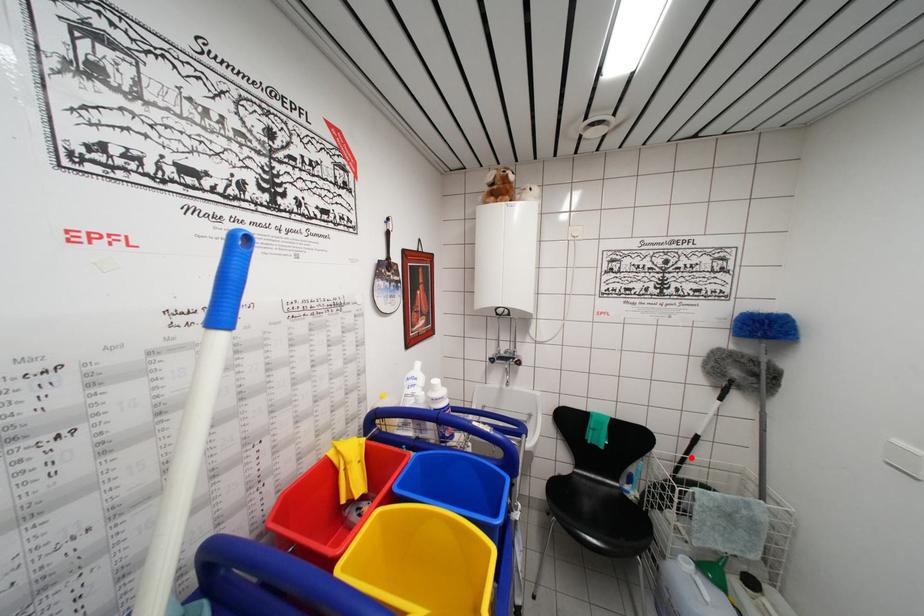
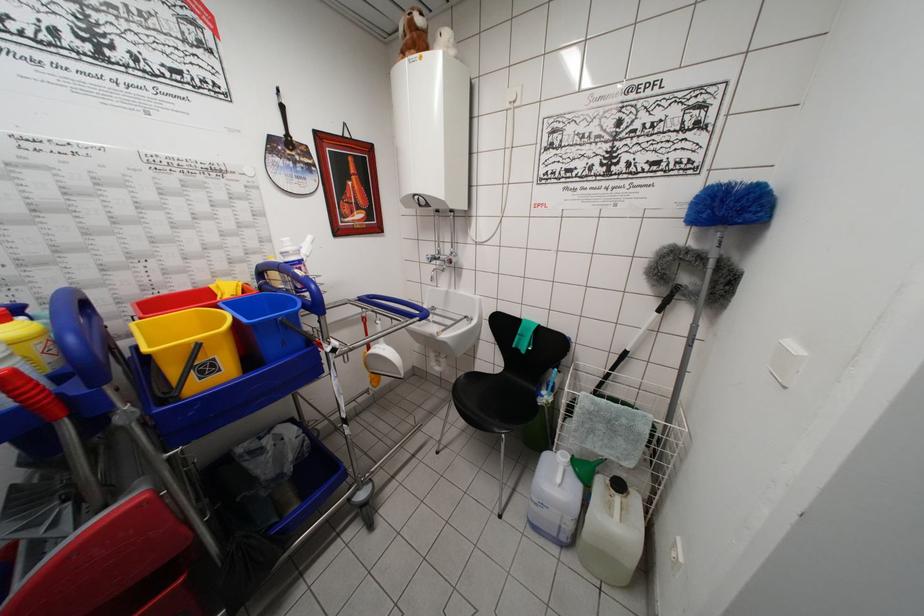
Find the pixel in the second image that matches the highlighted location in the first image.

(616, 374)